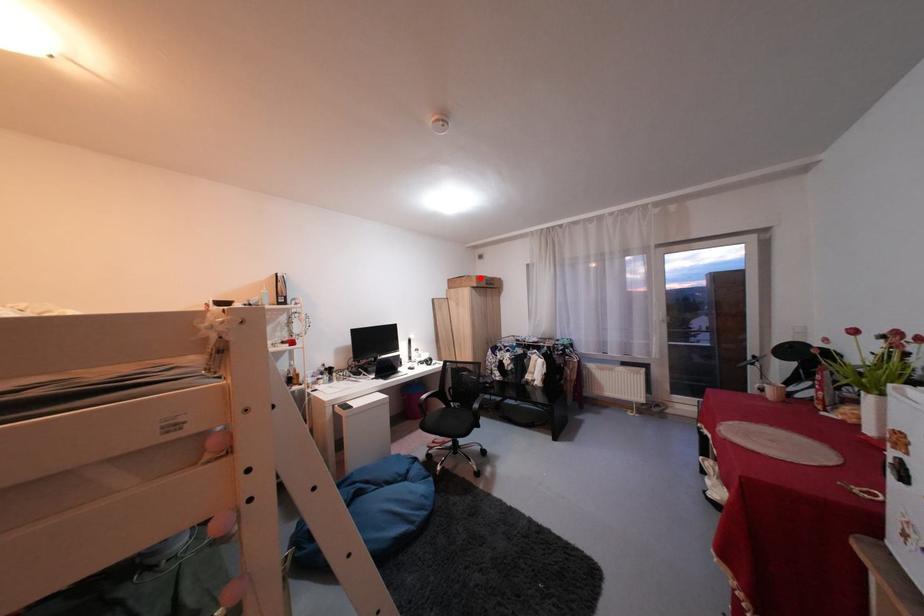
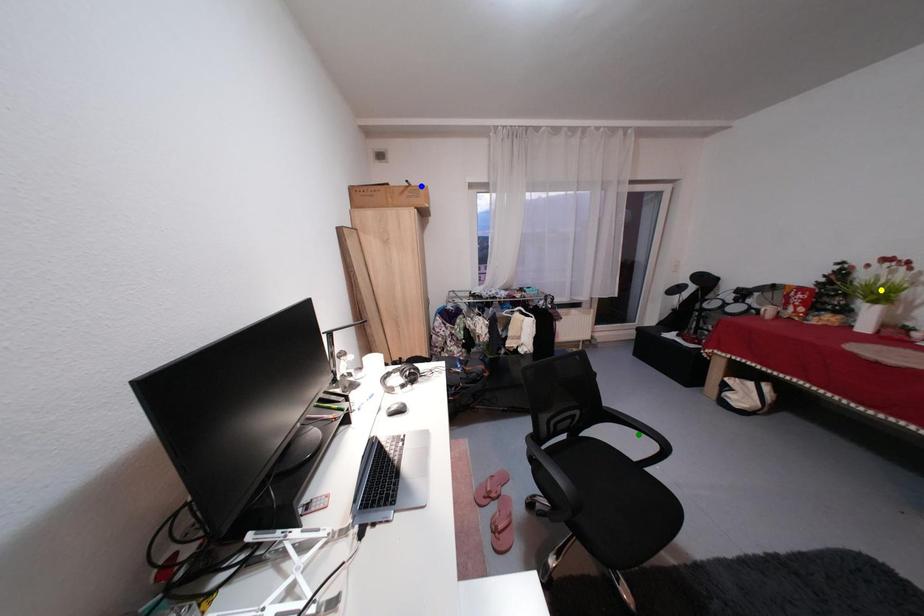
Question: I am providing you with two images of the same scene from different viewpoints. A red point is marked on the first image. You are given multiple points on the second image. Which mark in image 2 goes with the point in image 1?

Choices:
 (A) green point
 (B) blue point
 (C) yellow point

Answer: (B)